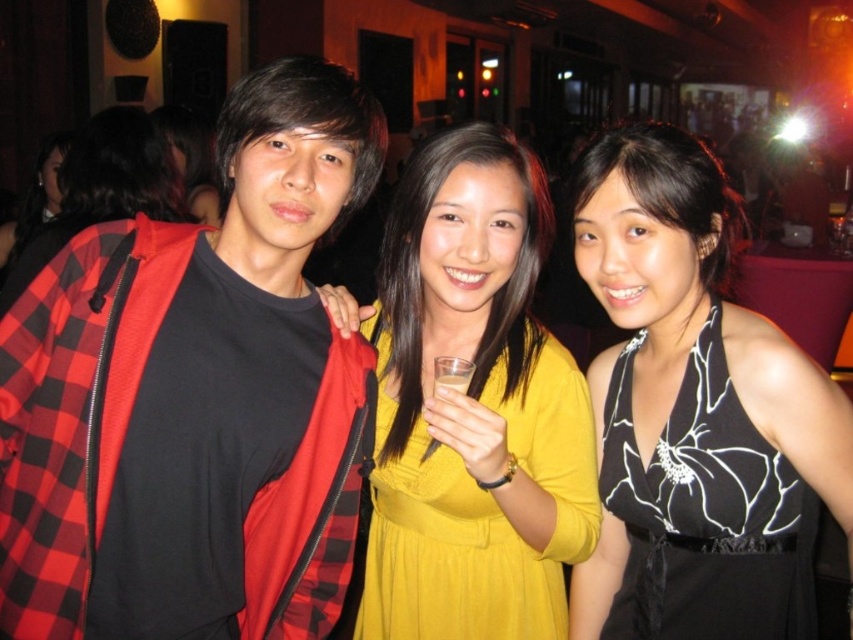
You are standing in the bar and want to hand a drink to the person wearing the red plaid jacket at center. Which direction should you move relative to your current position to reach them?

The red plaid jacket at center is located at point 0.622 on the x and 0.230 on the y coordinate, so you should move towards the right and slightly forward to reach them.

You are a photographer at the event and want to ensure that both the yellow satin dress at center and the clear plastic glass at center are clearly visible in the photo. Based on their sizes, which object should you focus on first to ensure sharpness?

The yellow satin dress at center is larger in size than the clear plastic glass at center, so focusing on the yellow satin dress at center first will ensure both are in focus since it is the larger object.